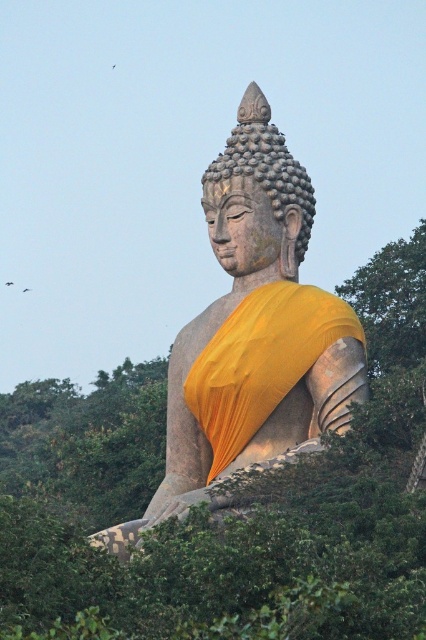
You are standing at point (103, 456) and want to reach the Buddha statue. Given that the statue is 479.34 feet away from your current position, can you estimate how long it would take to walk there at a normal pace?

At a normal walking pace of approximately 3 feet per second, it would take about 160 seconds to cover the 479.34 feet distance to the Buddha statue.